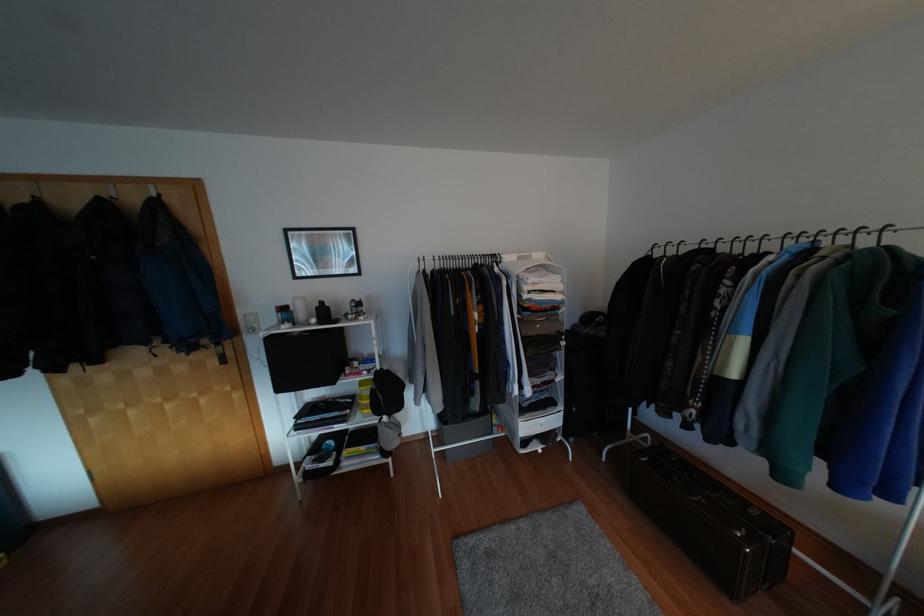
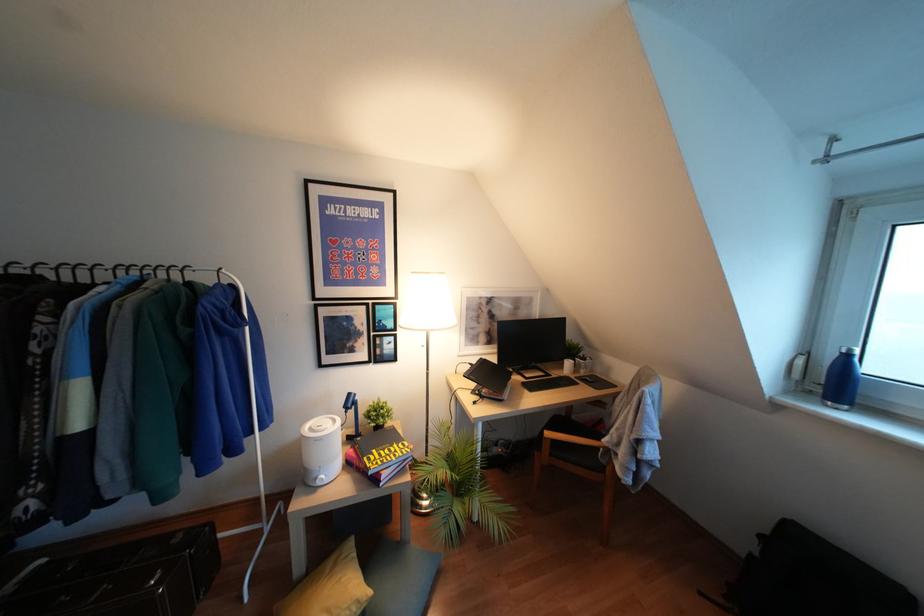
Question: The camera is either moving clockwise (left) or counter-clockwise (right) around the object. The first image is from the beginning of the video and the second image is from the end. Is the camera moving left or right when shooting the video?

Choices:
 (A) Left
 (B) Right

Answer: (A)